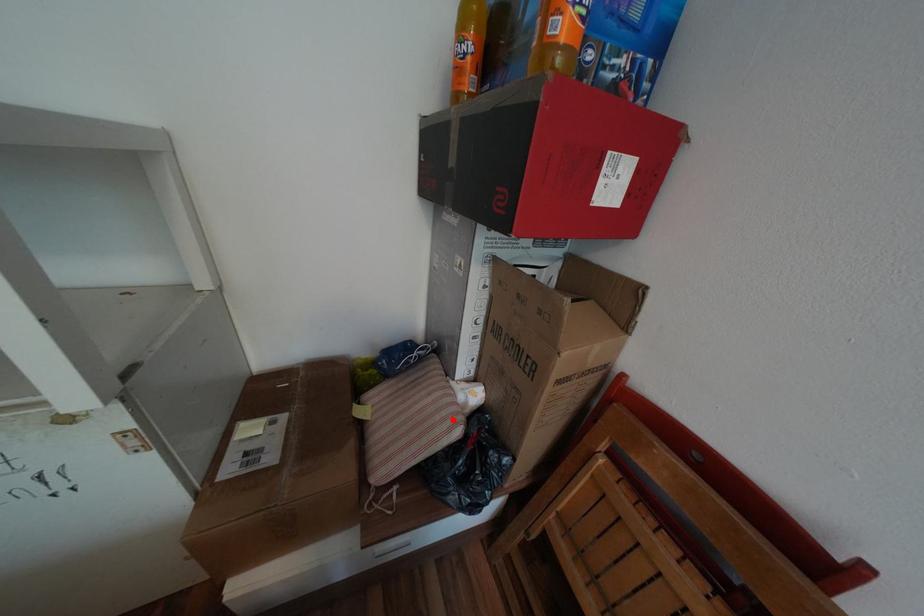
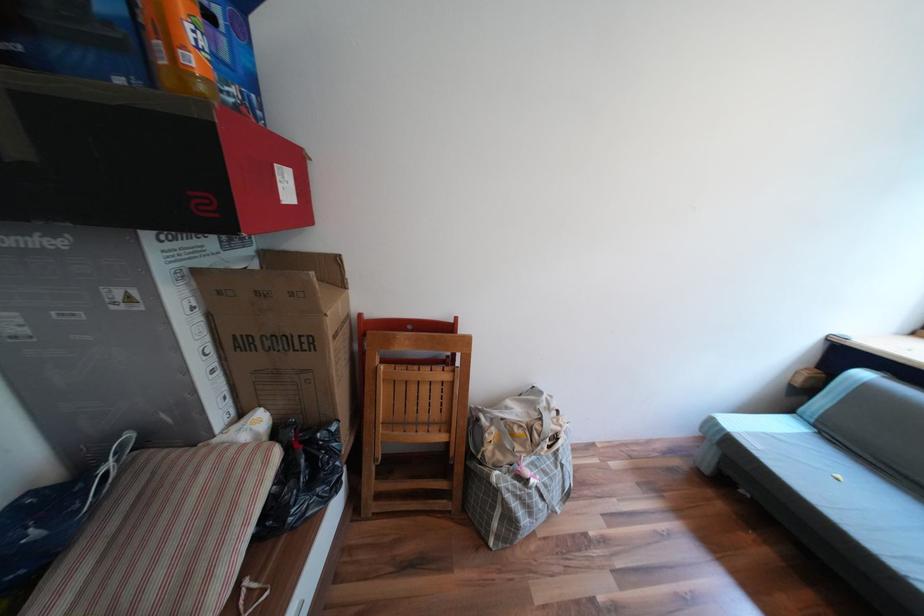
The point at the highlighted location is marked in the first image. Where is the corresponding point in the second image?

(258, 464)